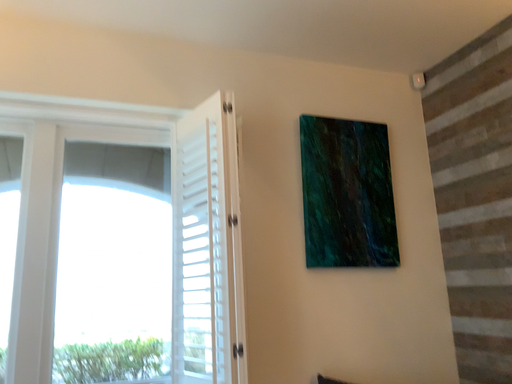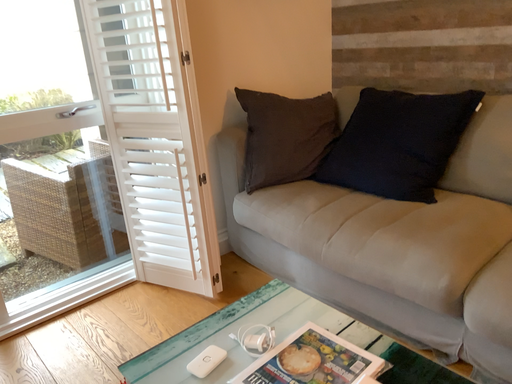
Question: Which way did the camera rotate in the video?

Choices:
 (A) rotated right
 (B) rotated left

Answer: (A)